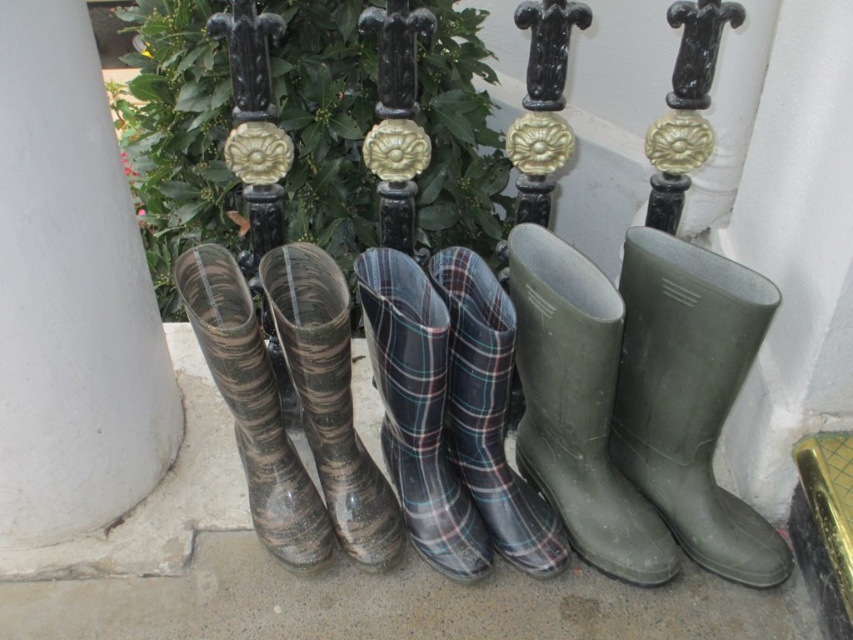
Can you confirm if white concrete pillar at lower left is bigger than camouflage rubber boots at left?

Yes, white concrete pillar at lower left is bigger than camouflage rubber boots at left.

Consider the image. Who is more forward, (71, 353) or (271, 394)?

Point (71, 353) is more forward.

Which is in front, point (107, 340) or point (228, 397)?

Point (228, 397) is in front.

Identify the location of white concrete pillar at lower left. Image resolution: width=853 pixels, height=640 pixels. (71, 294).

Can you confirm if brown rubber boots at center is positioned below camouflage rubber boots at left?

Correct, brown rubber boots at center is located below camouflage rubber boots at left.

The image size is (853, 640). Identify the location of brown rubber boots at center. (329, 397).

Which is in front, point (316, 403) or point (248, 340)?

Point (248, 340)

What are the coordinates of `brown rubber boots at center` in the screenshot? It's located at (329, 397).

Who is more distant from viewer, [563,285] or [396,308]?

Point [563,285]

What do you see at coordinates (577, 406) in the screenshot? I see `green rubber boot at center` at bounding box center [577, 406].

Where is `green rubber boot at center`? This screenshot has width=853, height=640. green rubber boot at center is located at coordinates (577, 406).